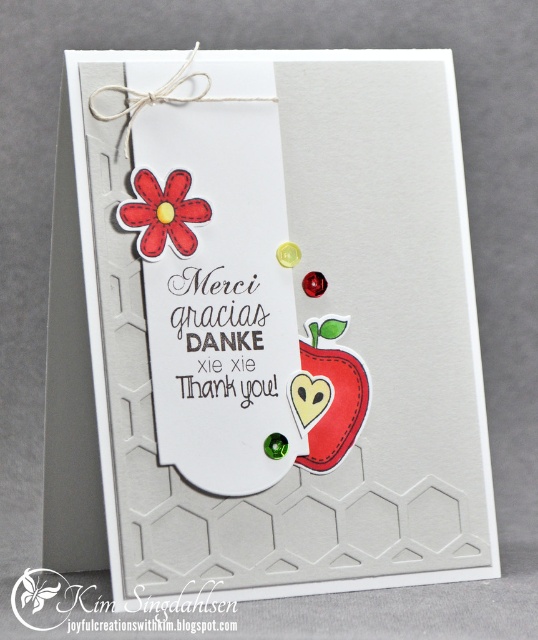
You are designing a greeting card and want to place a matte white tag and a matte red flower on it. According to the image, where should you position the matte white tag at center relative to the matte red flower at upper left?

The matte white tag at center should be positioned below the matte red flower at upper left as per the image.